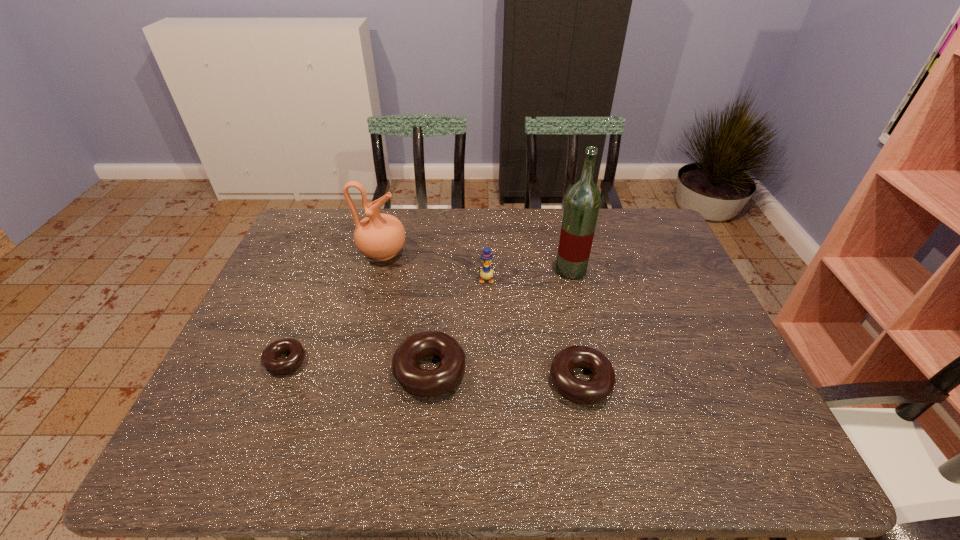
Where is `free space at the left edge of the desktop`? The height and width of the screenshot is (540, 960). free space at the left edge of the desktop is located at coordinates (265, 303).

Identify the location of free space at the right edge of the desktop. (722, 356).

This screenshot has width=960, height=540. Find the location of `free space at the far left corner of the desktop`. free space at the far left corner of the desktop is located at coordinates (294, 241).

At what (x,y) coordinates should I click in order to perform the action: click on free region at the near left corner. Please return your answer as a coordinate pair (x, y). This screenshot has width=960, height=540. Looking at the image, I should click on (249, 413).

In order to click on vacant space that is in between the second doughnut from left to right and the third object from right to left in this screenshot , I will do `click(458, 325)`.

In order to click on free area in between the tallest object and the fifth shortest object in this screenshot , I will do `click(477, 261)`.

Locate an element on the screen. The height and width of the screenshot is (540, 960). vacant area that lies between the second shortest doughnut and the second doughnut from left to right is located at coordinates (505, 376).

In order to click on free space between the second shortest doughnut and the second doughnut from right to left in this screenshot , I will do `click(505, 376)`.

Find the location of a particular element. The height and width of the screenshot is (540, 960). vacant point located between the second object from left to right and the fourth object from right to left is located at coordinates (406, 312).

At what (x,y) coordinates should I click in order to perform the action: click on free space between the second shortest doughnut and the liquor. Please return your answer as a coordinate pair (x, y). Looking at the image, I should click on (576, 326).